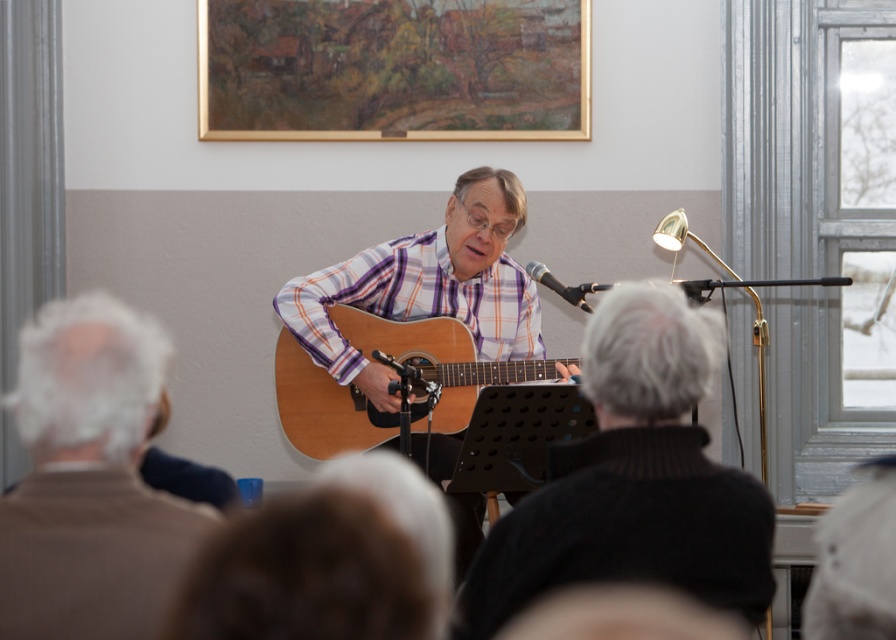
Is brown wool sweater at left to the right of natural wood acoustic guitar at center from the viewer's perspective?

In fact, brown wool sweater at left is to the left of natural wood acoustic guitar at center.

Does point (119, 440) come closer to viewer compared to point (463, 413)?

That is True.

Locate an element on the screen. This screenshot has width=896, height=640. brown wool sweater at left is located at coordinates (90, 481).

Is point (393, 284) positioned after point (530, 368)?

Yes, it is.

Who is more distant from viewer, (520, 321) or (411, 321)?

The point (520, 321) is more distant.

The width and height of the screenshot is (896, 640). Describe the element at coordinates (412, 300) in the screenshot. I see `purple striped shirt at center` at that location.

Where is `purple striped shirt at center`? purple striped shirt at center is located at coordinates (412, 300).

Which is behind, point (470, 404) or point (556, 289)?

The point (470, 404) is more distant.

Where is `natural wood acoustic guitar at center`? The image size is (896, 640). natural wood acoustic guitar at center is located at coordinates (436, 358).